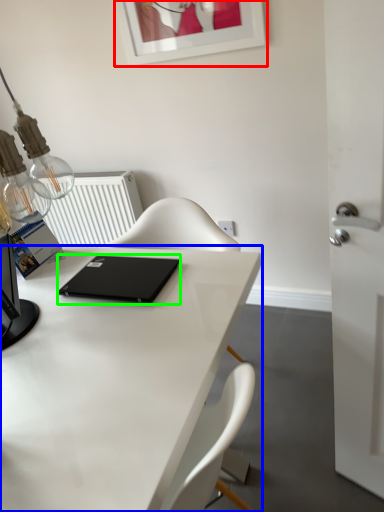
Question: Which is nearer to the picture frame (highlighted by a red box)? desk (highlighted by a blue box) or laptop (highlighted by a green box).

Choices:
 (A) desk
 (B) laptop

Answer: (B)